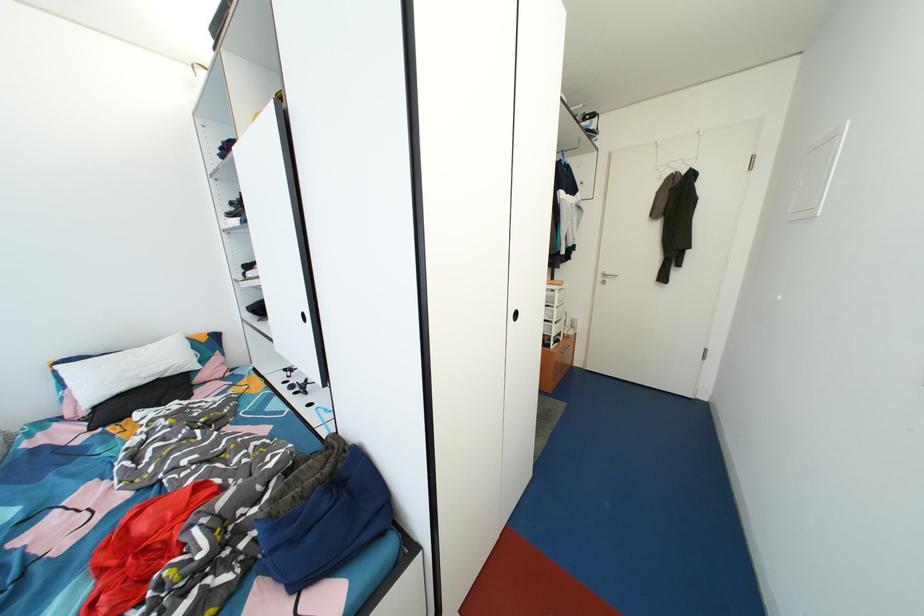
This screenshot has height=616, width=924. Find the location of `silver door handle`. silver door handle is located at coordinates (606, 276).